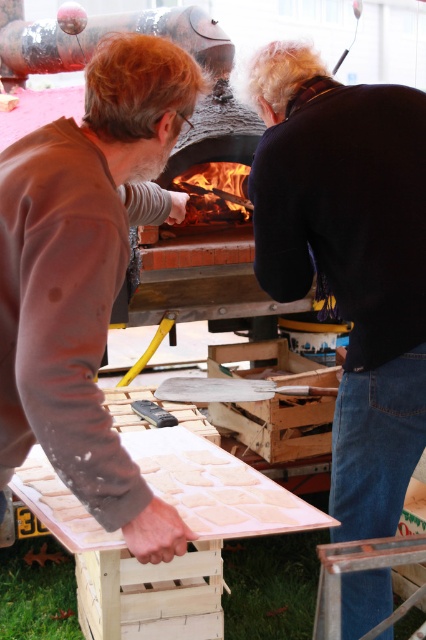
Find the location of a particular element. The image size is (426, 640). black matte shirt at upper right is located at coordinates (350, 259).

Who is more distant from viewer, (x=253, y=200) or (x=94, y=241)?

Positioned behind is point (x=253, y=200).

Locate an element on the screen. black matte shirt at upper right is located at coordinates (350, 259).

You are a GUI agent. You are given a task and a screenshot of the screen. Output one action in this format:
    pyautogui.click(x=<x>, y=<y>)
    Task: Click on the black matte shirt at upper right
    
    Given the screenshot: What is the action you would take?
    pyautogui.click(x=350, y=259)